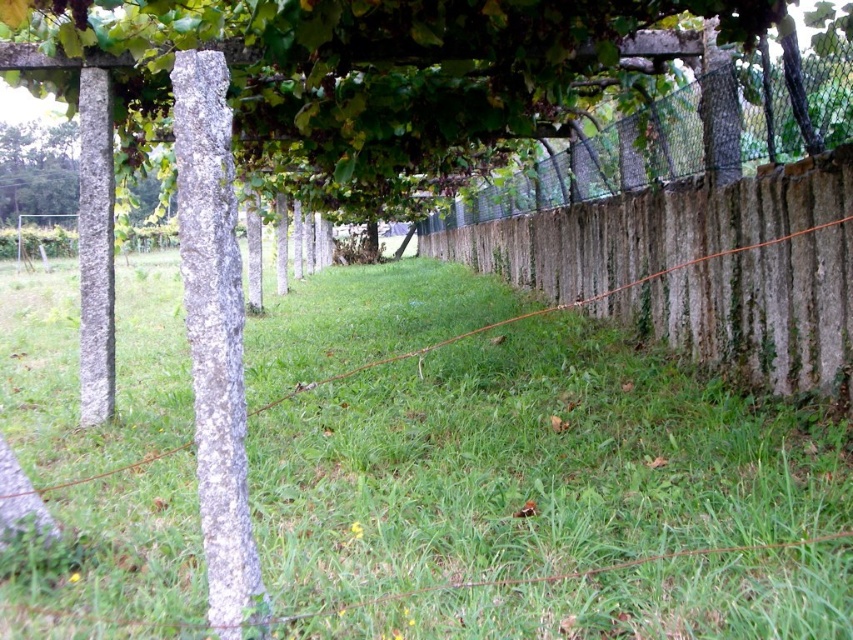
You are standing at the origin point in this vineyard scene. Where would you find the green grass at center?

The green grass at center is located at the coordinates point (524,467).

You are a gardener planning to install a new trellis system between the green leafy tree at upper center and the rustic wooden fence at center. Considering their widths, which object requires more space for the trellis to fit properly?

The green leafy tree at upper center requires more space for the trellis because its width surpasses that of the rustic wooden fence at center.